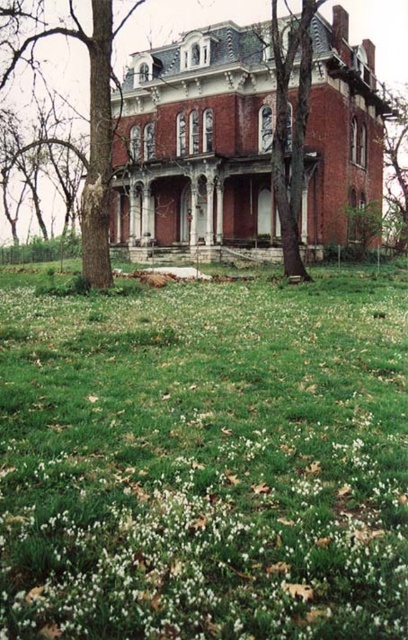
Can you confirm if smooth bark tree at upper right is positioned to the right of stone steps at center?

Indeed, smooth bark tree at upper right is positioned on the right side of stone steps at center.

Which is behind, point (405, 243) or point (254, 246)?

Positioned behind is point (405, 243).

Find the location of `smooth bark tree at upper right`. smooth bark tree at upper right is located at coordinates pyautogui.click(x=396, y=168).

Is green grass at center above stone steps at center?

Actually, green grass at center is below stone steps at center.

Which is more to the right, green grass at center or stone steps at center?

Positioned to the right is green grass at center.

Which is behind, point (137, 627) or point (163, 260)?

Point (163, 260)

This screenshot has width=408, height=640. What are the coordinates of `green grass at center` in the screenshot? It's located at (204, 461).

Between green grass at center and smooth bark tree at upper right, which one has less height?

green grass at center is shorter.

Is point (232, 324) in front of point (401, 195)?

Yes, it is.

In order to click on green grass at center in this screenshot , I will do `click(204, 461)`.